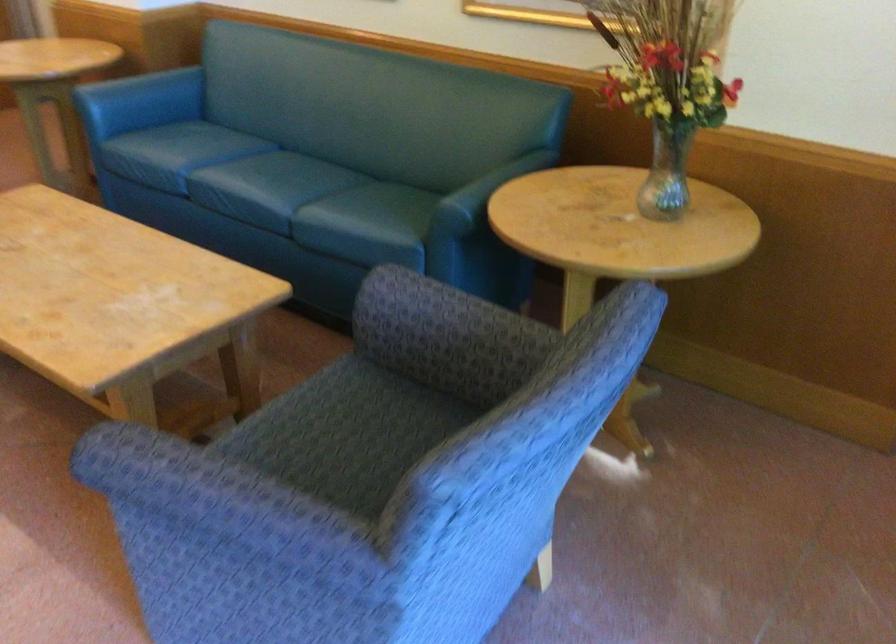
Question: The camera is either moving clockwise (left) or counter-clockwise (right) around the object. The first image is from the beginning of the video and the second image is from the end. Is the camera moving left or right when shooting the video?

Choices:
 (A) Left
 (B) Right

Answer: (B)